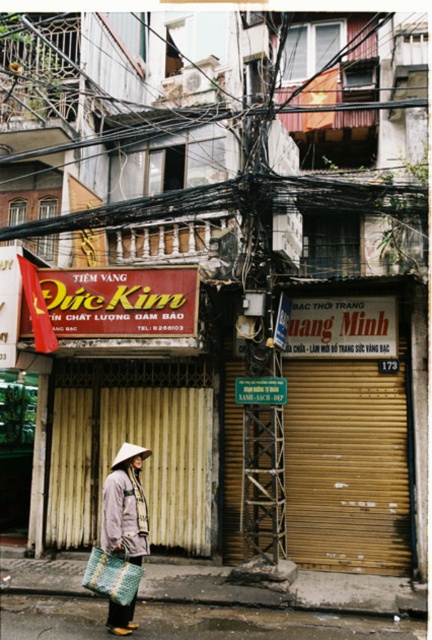
You are a delivery person who needs to pack a matte fabric bag at lower center and a light gray woven hat at lower left into a box. The box can only fit items up to the size of the larger object. Will both items fit?

The matte fabric bag at lower center is bigger than the light gray woven hat at lower left. Since the box can fit up to the size of the larger object, which is the matte fabric bag at lower center, both items will fit in the box.

Consider the image. You are a delivery person who needs to place a small package between the matte fabric bag at lower center and the light gray woven hat at lower left. Can you fit it there?

A: The matte fabric bag at lower center is positioned on the right side of light gray woven hat at lower left, so there is space between them to place the small package.